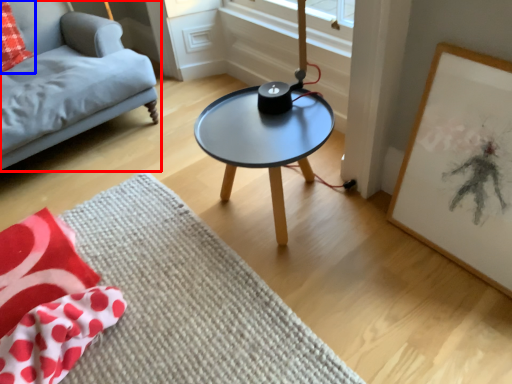
Question: Among these objects, which one is nearest to the camera, studio couch (highlighted by a red box) or throw pillow (highlighted by a blue box)?

Choices:
 (A) studio couch
 (B) throw pillow

Answer: (A)